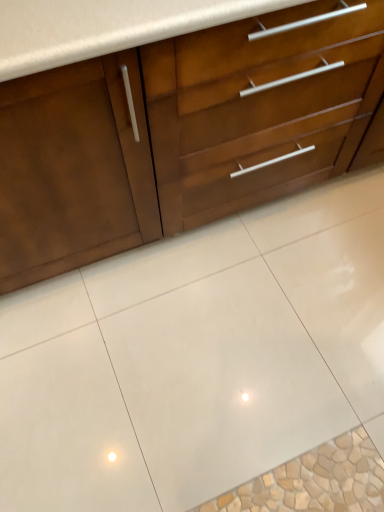
Question: Is white glossy tile at center spatially inside matte wood cabinet at upper left, or outside of it?

Choices:
 (A) outside
 (B) inside

Answer: (A)

Question: In terms of height, does white glossy tile at center look taller or shorter compared to matte wood cabinet at upper left?

Choices:
 (A) tall
 (B) short

Answer: (B)

Question: From the image's perspective, is white glossy tile at center above or below matte wood cabinet at upper left?

Choices:
 (A) above
 (B) below

Answer: (B)

Question: In the image, is matte wood cabinet at upper left on the left side or the right side of white glossy tile at center?

Choices:
 (A) right
 (B) left

Answer: (B)

Question: Is matte wood cabinet at upper left taller or shorter than white glossy tile at center?

Choices:
 (A) short
 (B) tall

Answer: (B)

Question: Considering the positions of matte wood cabinet at upper left and white glossy tile at center in the image, is matte wood cabinet at upper left wider or thinner than white glossy tile at center?

Choices:
 (A) thin
 (B) wide

Answer: (A)

Question: From a real-world perspective, is matte wood cabinet at upper left above or below white glossy tile at center?

Choices:
 (A) below
 (B) above

Answer: (B)